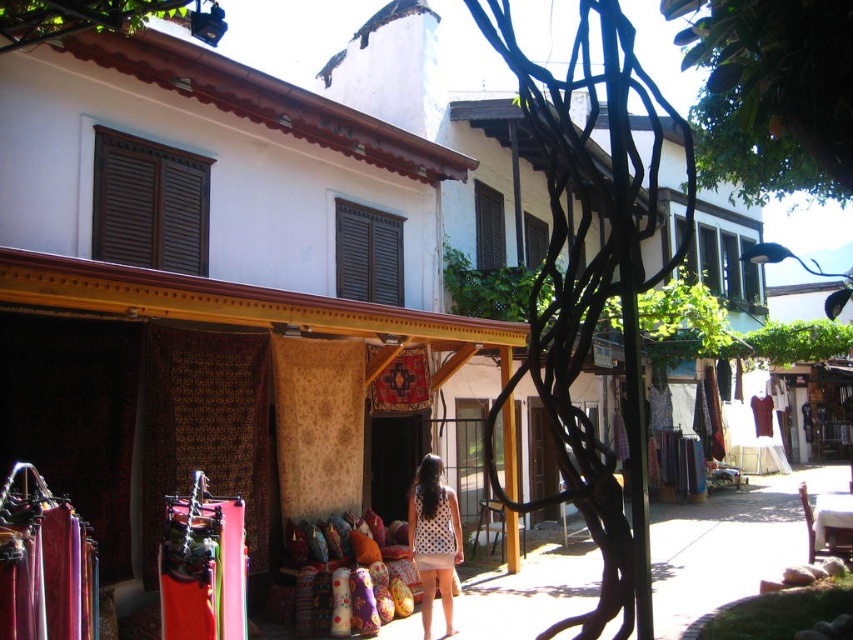
You are a tourist standing in the street scene and want to take a photo of the white dotted dress at center without the green leafy tree at upper right blocking it. How should you adjust your position?

Move closer to the white dotted dress at center so that the green leafy tree at upper right is farther away and no longer blocking the view.

You are a customer in a shop and see the white dotted dress at center and the green leafy tree at upper center. Which item is taller?

The white dotted dress at center is taller than the green leafy tree at upper center.

Looking at this image, you are standing at the point with coordinates point [770,17] and want to walk towards the point with coordinates point [434,488]. Which direction should you move relative to the tree?

You should move towards the point [434,488], which is behind the tree relative to your starting position at point [770,17], since point [770,17] is in front of point [434,488].